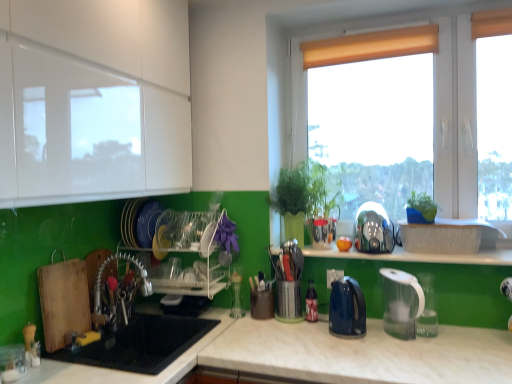
Question: Considering the relative sizes of green plastic plant at right, which is the first plant in front-to-back order, and shiny metallic kettle at center-right, which is the 2th appliance in bottom-to-top order, in the image provided, is green plastic plant at right, which is the first plant in front-to-back order, shorter than shiny metallic kettle at center-right, which is the 2th appliance in bottom-to-top order,?

Choices:
 (A) no
 (B) yes

Answer: (B)

Question: Is green plastic plant at right, arranged as the 1th plant when viewed from the right, bigger than shiny metallic kettle at center-right, the 1th appliance from the right?

Choices:
 (A) no
 (B) yes

Answer: (A)

Question: Is the position of green plastic plant at right, the 2th plant in the left-to-right sequence, less distant than that of shiny metallic kettle at center-right, the 1th appliance from the right?

Choices:
 (A) yes
 (B) no

Answer: (A)

Question: Is green plastic plant at right, the 2th plant in the left-to-right sequence, turned away from shiny metallic kettle at center-right, which is the 2th appliance in bottom-to-top order?

Choices:
 (A) no
 (B) yes

Answer: (A)

Question: Would you say green plastic plant at right, arranged as the 1th plant when viewed from the right, contains shiny metallic kettle at center-right, the 1th appliance from the right?

Choices:
 (A) yes
 (B) no

Answer: (B)

Question: Is brushed metal faucet at lower left wider or thinner than blue glossy electric kettle at center, the 2th kitchen appliance in the right-to-left sequence?

Choices:
 (A) wide
 (B) thin

Answer: (B)

Question: From a real-world perspective, is brushed metal faucet at lower left physically located above or below blue glossy electric kettle at center, which appears as the 1th kitchen appliance when viewed from the left?

Choices:
 (A) above
 (B) below

Answer: (A)

Question: Is brushed metal faucet at lower left in front of or behind blue glossy electric kettle at center, which appears as the 1th kitchen appliance when viewed from the left, in the image?

Choices:
 (A) behind
 (B) front

Answer: (A)

Question: Does point (117, 324) appear closer or farther from the camera than point (357, 322)?

Choices:
 (A) closer
 (B) farther

Answer: (B)

Question: Is green matte plant at center, the second plant when ordered from right to left, situated inside green plastic plant at right, the 2th plant viewed from the back, or outside?

Choices:
 (A) outside
 (B) inside

Answer: (A)

Question: Visually, is green matte plant at center, the second plant when ordered from right to left, positioned to the left or to the right of green plastic plant at right, which is the first plant in front-to-back order?

Choices:
 (A) left
 (B) right

Answer: (A)

Question: Is green matte plant at center, which appears as the 1th plant when viewed from the left, wider or thinner than green plastic plant at right, arranged as the 1th plant when viewed from the right?

Choices:
 (A) wide
 (B) thin

Answer: (A)

Question: Is green matte plant at center, the 2th plant viewed from the front, taller or shorter than green plastic plant at right, the 2th plant viewed from the back?

Choices:
 (A) short
 (B) tall

Answer: (B)

Question: Considering the positions of black matte sink at lower left and matte white window at upper right in the image, is black matte sink at lower left taller or shorter than matte white window at upper right?

Choices:
 (A) tall
 (B) short

Answer: (B)

Question: From a real-world perspective, is black matte sink at lower left above or below matte white window at upper right?

Choices:
 (A) above
 (B) below

Answer: (B)